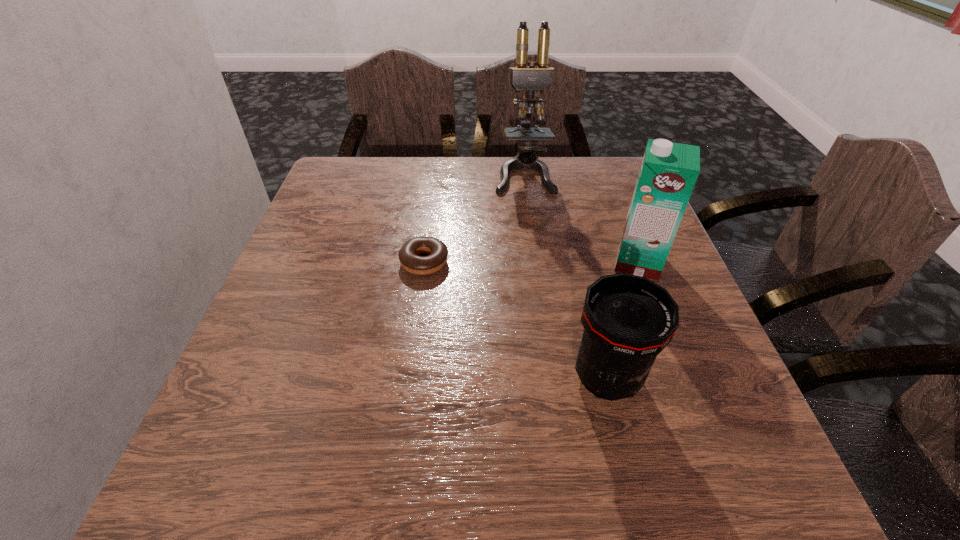
Identify the location of vacant area between the rightmost object and the doughnut. This screenshot has height=540, width=960. (531, 262).

Locate which object ranks third in proximity to the tallest object. Please provide its 2D coordinates. Your answer should be formatted as a tuple, i.e. [(x, y)], where the tuple contains the x and y coordinates of a point satisfying the conditions above.

[(628, 320)]

This screenshot has height=540, width=960. Find the location of `object identified as the second closest to the tallest object`. object identified as the second closest to the tallest object is located at coordinates (408, 255).

The width and height of the screenshot is (960, 540). Find the location of `free spot that satisfies the following two spatial constraints: 1. at the eyepieces of the tallest object; 2. on the right side of the telephoto lens`. free spot that satisfies the following two spatial constraints: 1. at the eyepieces of the tallest object; 2. on the right side of the telephoto lens is located at coordinates (552, 377).

Locate an element on the screen. The image size is (960, 540). free location that satisfies the following two spatial constraints: 1. at the eyepieces of the carton; 2. on the left side of the tallest object is located at coordinates (537, 262).

I want to click on vacant space that satisfies the following two spatial constraints: 1. on the front side of the leftmost object; 2. on the right side of the second tallest object, so click(424, 262).

Find the location of a particular element. The image size is (960, 540). vacant space that satisfies the following two spatial constraints: 1. at the eyepieces of the tallest object; 2. on the left side of the second tallest object is located at coordinates (537, 262).

Image resolution: width=960 pixels, height=540 pixels. Identify the location of free spot that satisfies the following two spatial constraints: 1. at the eyepieces of the farthest object; 2. on the right side of the second shortest object. (552, 377).